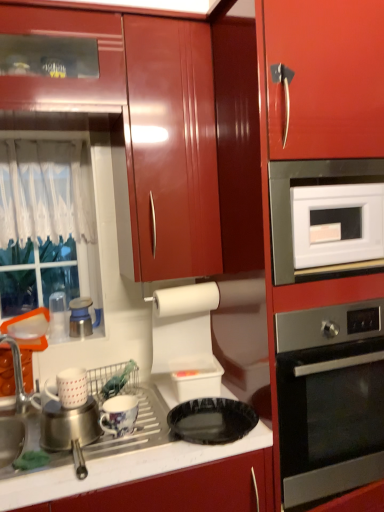
At what (x,y) coordinates should I click in order to perform the action: click on free space above white sheer curtain at left (from a real-world perspective). Please return your answer as a coordinate pair (x, y). Looking at the image, I should click on (23, 140).